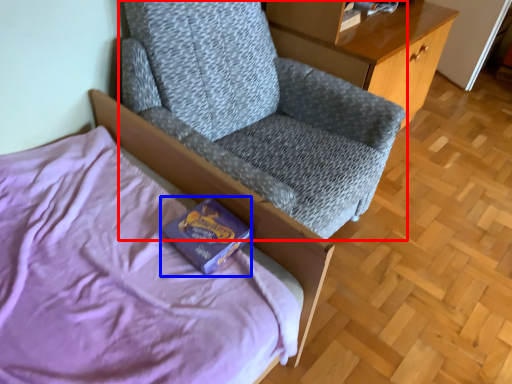
Question: Among these objects, which one is farthest to the camera, chair (highlighted by a red box) or paperback book (highlighted by a blue box)?

Choices:
 (A) chair
 (B) paperback book

Answer: (B)